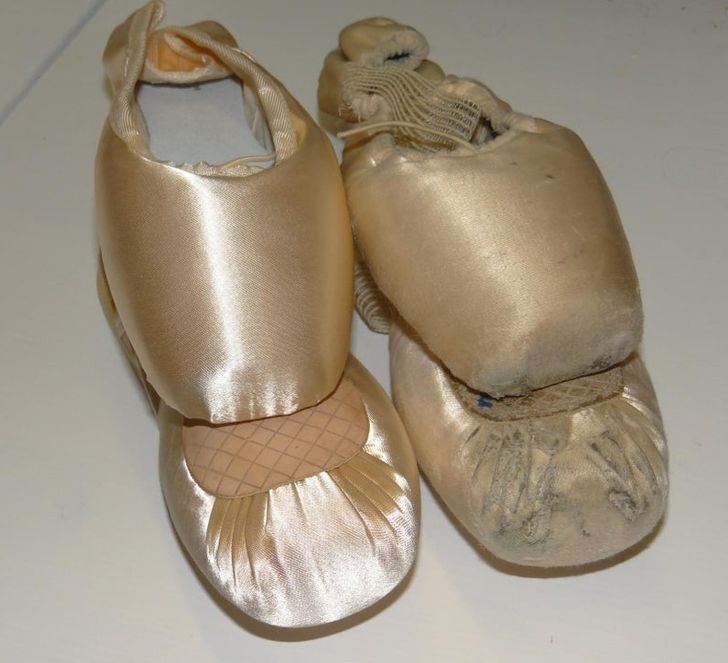
Locate an element on the screen. floor is located at coordinates (62, 402).